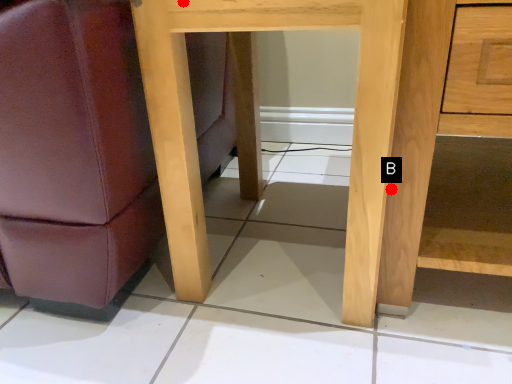
Question: Two points are circled on the image, labeled by A and B beside each circle. Among these points, which one is farthest from the camera?

Choices:
 (A) A is further
 (B) B is further

Answer: (B)